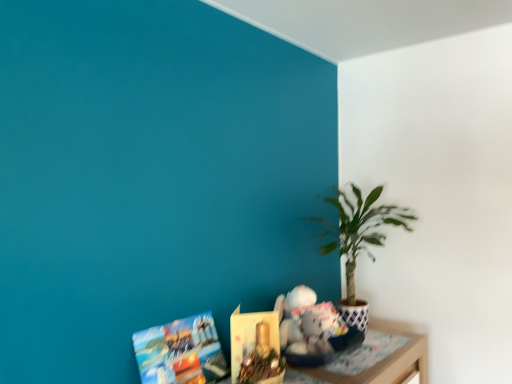
What do you see at coordinates (180, 352) in the screenshot? I see `matte paper book at lower left, arranged as the second book when viewed from the right` at bounding box center [180, 352].

What do you see at coordinates (377, 361) in the screenshot? Image resolution: width=512 pixels, height=384 pixels. I see `wooden table at lower right` at bounding box center [377, 361].

The width and height of the screenshot is (512, 384). I want to click on wooden table at lower right, so click(377, 361).

This screenshot has width=512, height=384. What do you see at coordinates (256, 348) in the screenshot?
I see `matte paper book at lower center, the first book positioned from the right` at bounding box center [256, 348].

Locate an element on the screen. The width and height of the screenshot is (512, 384). matte paper book at lower center, the first book positioned from the right is located at coordinates click(x=256, y=348).

This screenshot has height=384, width=512. I want to click on matte paper book at lower left, the 1th book when ordered from left to right, so click(180, 352).

Between matte paper book at lower left, arranged as the second book when viewed from the right, and green leafy plant at right, which one appears on the right side from the viewer's perspective?

green leafy plant at right.

You are a GUI agent. You are given a task and a screenshot of the screen. Output one action in this format:
    pyautogui.click(x=<x>, y=<y>)
    Task: Click on the houseplant above the matte paper book at lower left, the 1th book when ordered from left to right (from the image's perspective)
    The height and width of the screenshot is (384, 512).
    Given the screenshot: What is the action you would take?
    pyautogui.click(x=358, y=240)

From a real-world perspective, is matte paper book at lower left, the 1th book when ordered from left to right, located beneath green leafy plant at right?

Yes, from a real-world perspective, matte paper book at lower left, the 1th book when ordered from left to right, is beneath green leafy plant at right.

Consider the image. Is the surface of matte paper book at lower left, the 1th book when ordered from left to right, in direct contact with green leafy plant at right?

There is a gap between matte paper book at lower left, the 1th book when ordered from left to right, and green leafy plant at right.

Between wooden table at lower right and green leafy plant at right, which one has larger width?

With larger width is green leafy plant at right.

From the image's perspective, is wooden table at lower right above or below green leafy plant at right?

wooden table at lower right is situated lower than green leafy plant at right in the image.

Looking at this image, is wooden table at lower right located outside green leafy plant at right?

Actually, wooden table at lower right is within green leafy plant at right.

Looking at this image, is matte paper book at lower left, arranged as the second book when viewed from the right, oriented towards matte paper book at lower center, which is the 2th book from left to right?

Yes, matte paper book at lower left, arranged as the second book when viewed from the right, faces towards matte paper book at lower center, which is the 2th book from left to right.

Locate an element on the screen. The image size is (512, 384). book that appears above the matte paper book at lower left, arranged as the second book when viewed from the right (from the image's perspective) is located at coordinates (256, 348).

How different are the orientations of matte paper book at lower left, the 1th book when ordered from left to right, and matte paper book at lower center, the first book positioned from the right, in degrees?

The facing directions of matte paper book at lower left, the 1th book when ordered from left to right, and matte paper book at lower center, the first book positioned from the right, are 41.9 degrees apart.

Is matte paper book at lower center, which is the 2th book from left to right, situated inside green leafy plant at right or outside?

matte paper book at lower center, which is the 2th book from left to right, is outside green leafy plant at right.

Which of these two, matte paper book at lower center, the first book positioned from the right, or green leafy plant at right, stands shorter?

With less height is matte paper book at lower center, the first book positioned from the right.

Is matte paper book at lower center, the first book positioned from the right, aimed at green leafy plant at right?

No, matte paper book at lower center, the first book positioned from the right, is not aimed at green leafy plant at right.

Considering the positions of objects wooden table at lower right and matte paper book at lower left, the 1th book when ordered from left to right, in the image provided, who is more to the right, wooden table at lower right or matte paper book at lower left, the 1th book when ordered from left to right,?

Positioned to the right is wooden table at lower right.

Image resolution: width=512 pixels, height=384 pixels. Identify the location of table behind the matte paper book at lower left, the 1th book when ordered from left to right. (377, 361).

From the image's perspective, which one is positioned lower, wooden table at lower right or matte paper book at lower left, arranged as the second book when viewed from the right?

wooden table at lower right.

From a real-world perspective, is wooden table at lower right located higher than matte paper book at lower left, arranged as the second book when viewed from the right?

Actually, wooden table at lower right is physically below matte paper book at lower left, arranged as the second book when viewed from the right, in the real world.

Is green leafy plant at right bigger than matte paper book at lower left, the 1th book when ordered from left to right?

Yes.

From a real-world perspective, does green leafy plant at right sit lower than matte paper book at lower left, arranged as the second book when viewed from the right?

No, from a real-world perspective, green leafy plant at right is not beneath matte paper book at lower left, arranged as the second book when viewed from the right.

Which is less distant, [406,214] or [211,336]?

Point [406,214].

Which of these two, green leafy plant at right or matte paper book at lower left, the 1th book when ordered from left to right, is wider?

green leafy plant at right is wider.

From a real-world perspective, is matte paper book at lower left, the 1th book when ordered from left to right, under wooden table at lower right?

No, from a real-world perspective, matte paper book at lower left, the 1th book when ordered from left to right, is not under wooden table at lower right.

Between matte paper book at lower left, the 1th book when ordered from left to right, and wooden table at lower right, which one has more height?

matte paper book at lower left, the 1th book when ordered from left to right, is taller.

Considering the sizes of matte paper book at lower left, the 1th book when ordered from left to right, and wooden table at lower right in the image, is matte paper book at lower left, the 1th book when ordered from left to right, bigger or smaller than wooden table at lower right?

Clearly, matte paper book at lower left, the 1th book when ordered from left to right, is larger in size than wooden table at lower right.

Is matte paper book at lower left, arranged as the second book when viewed from the right, inside or outside of wooden table at lower right?

matte paper book at lower left, arranged as the second book when viewed from the right, exists outside the volume of wooden table at lower right.

Identify the location of the 2nd book below the green leafy plant at right (from the image's perspective). The image size is (512, 384). (180, 352).

The width and height of the screenshot is (512, 384). I want to click on table that is on the left side of green leafy plant at right, so click(377, 361).

Based on their spatial positions, is matte paper book at lower left, arranged as the second book when viewed from the right, or matte paper book at lower center, the first book positioned from the right, closer to green leafy plant at right?

matte paper book at lower center, the first book positioned from the right, lies closer to green leafy plant at right than the other object.

From the picture: Looking at the image, which one is located further to matte paper book at lower center, the first book positioned from the right, wooden table at lower right or matte paper book at lower left, the 1th book when ordered from left to right?

wooden table at lower right lies further to matte paper book at lower center, the first book positioned from the right, than the other object.

Considering their positions, is matte paper book at lower left, the 1th book when ordered from left to right, positioned closer to green leafy plant at right than wooden table at lower right?

wooden table at lower right is positioned closer to the anchor green leafy plant at right.

Which object lies nearer to the anchor point matte paper book at lower left, arranged as the second book when viewed from the right, wooden table at lower right or matte paper book at lower center, the first book positioned from the right?

matte paper book at lower center, the first book positioned from the right, is closer to matte paper book at lower left, arranged as the second book when viewed from the right.

In the scene shown: Considering their positions, is matte paper book at lower center, which is the 2th book from left to right, positioned further to green leafy plant at right than wooden table at lower right?

The object further to green leafy plant at right is matte paper book at lower center, which is the 2th book from left to right.

From the picture: From the image, which object appears to be farther from matte paper book at lower center, which is the 2th book from left to right, green leafy plant at right or wooden table at lower right?

green leafy plant at right is further to matte paper book at lower center, which is the 2th book from left to right.

From the image, which object appears to be nearer to green leafy plant at right, wooden table at lower right or matte paper book at lower center, which is the 2th book from left to right?

wooden table at lower right.

Based on their spatial positions, is matte paper book at lower center, the first book positioned from the right, or wooden table at lower right closer to matte paper book at lower left, arranged as the second book when viewed from the right?

Among the two, matte paper book at lower center, the first book positioned from the right, is located nearer to matte paper book at lower left, arranged as the second book when viewed from the right.

You are a GUI agent. You are given a task and a screenshot of the screen. Output one action in this format:
    pyautogui.click(x=<x>, y=<y>)
    Task: Click on the book between matte paper book at lower left, the 1th book when ordered from left to right, and wooden table at lower right
    
    Given the screenshot: What is the action you would take?
    pyautogui.click(x=256, y=348)

The width and height of the screenshot is (512, 384). In order to click on table between matte paper book at lower left, the 1th book when ordered from left to right, and green leafy plant at right, in the horizontal direction in this screenshot , I will do `click(377, 361)`.

At what (x,y) coordinates should I click in order to perform the action: click on table located between matte paper book at lower center, the first book positioned from the right, and green leafy plant at right in the left-right direction. Please return your answer as a coordinate pair (x, y). This screenshot has width=512, height=384. Looking at the image, I should click on (377, 361).

The height and width of the screenshot is (384, 512). In order to click on book between matte paper book at lower left, arranged as the second book when viewed from the right, and green leafy plant at right, in the horizontal direction in this screenshot , I will do `click(256, 348)`.